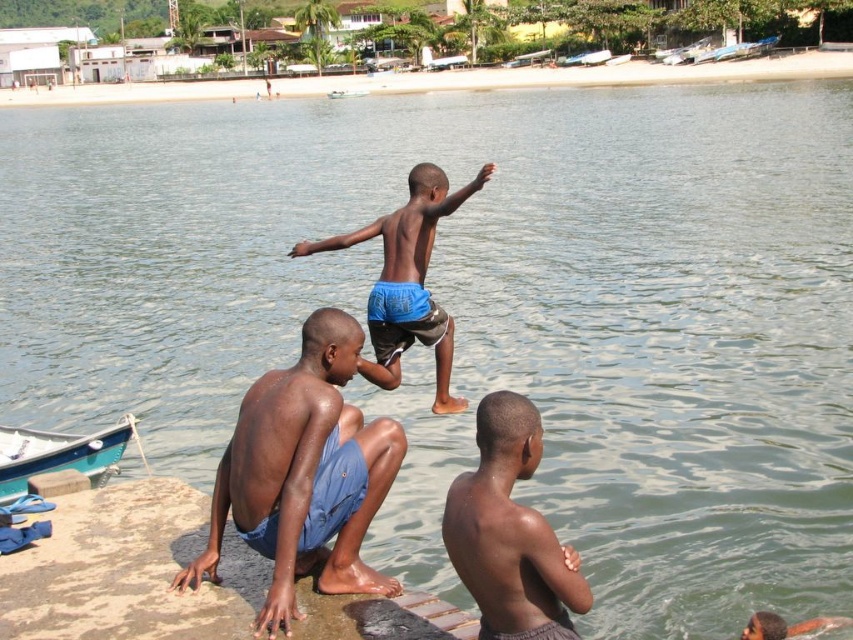
Question: Which object appears closest to the camera in this image?

Choices:
 (A) blue cotton shorts at lower left
 (B) teal plastic boat at center
 (C) blue shorts at center
 (D) teal wooden boat at lower left

Answer: (A)

Question: Which of the following is the farthest from the observer?

Choices:
 (A) (383, 320)
 (B) (339, 492)
 (C) (357, 92)
 (D) (558, 572)

Answer: (C)

Question: Is blue cotton shorts at lower left positioned behind teal plastic boat at center?

Choices:
 (A) yes
 (B) no

Answer: (B)

Question: Does blue cotton shorts at lower left appear on the left side of teal wooden boat at lower left?

Choices:
 (A) no
 (B) yes

Answer: (A)

Question: Which object is farther from the camera taking this photo?

Choices:
 (A) dry skin at lower right
 (B) blue cotton shorts at lower left

Answer: (B)

Question: Can you confirm if dry skin at lower right is smaller than blue shorts at center?

Choices:
 (A) no
 (B) yes

Answer: (B)